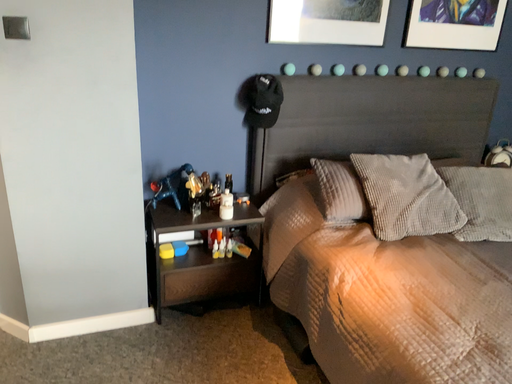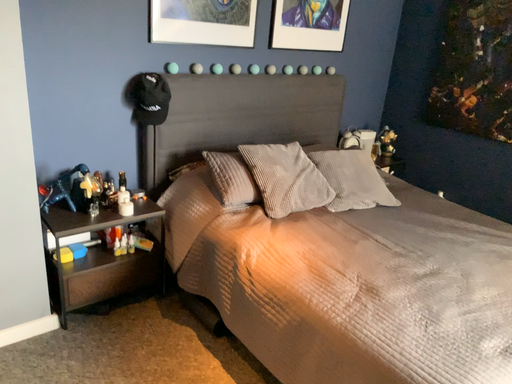
Question: How did the camera likely rotate when shooting the video?

Choices:
 (A) rotated left
 (B) rotated right

Answer: (B)